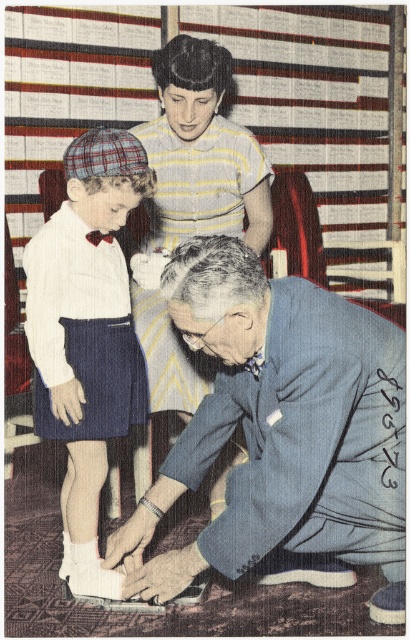
Question: Observing the image, what is the correct spatial positioning of blue fabric suit at lower center in reference to striped fabric dress at upper center?

Choices:
 (A) left
 (B) right

Answer: (B)

Question: Does matte plaid cap at left appear on the left side of striped fabric dress at upper center?

Choices:
 (A) no
 (B) yes

Answer: (B)

Question: Estimate the real-world distances between objects in this image. Which object is closer to the matte plaid cap at left?

Choices:
 (A) blue fabric suit at lower center
 (B) striped fabric dress at upper center

Answer: (B)

Question: Which of the following is the closest to the observer?

Choices:
 (A) blue fabric suit at lower center
 (B) matte plaid cap at left

Answer: (A)

Question: Can you confirm if blue fabric suit at lower center is positioned to the right of striped fabric dress at upper center?

Choices:
 (A) no
 (B) yes

Answer: (B)

Question: Which object appears closest to the camera in this image?

Choices:
 (A) striped fabric dress at upper center
 (B) blue fabric suit at lower center

Answer: (B)